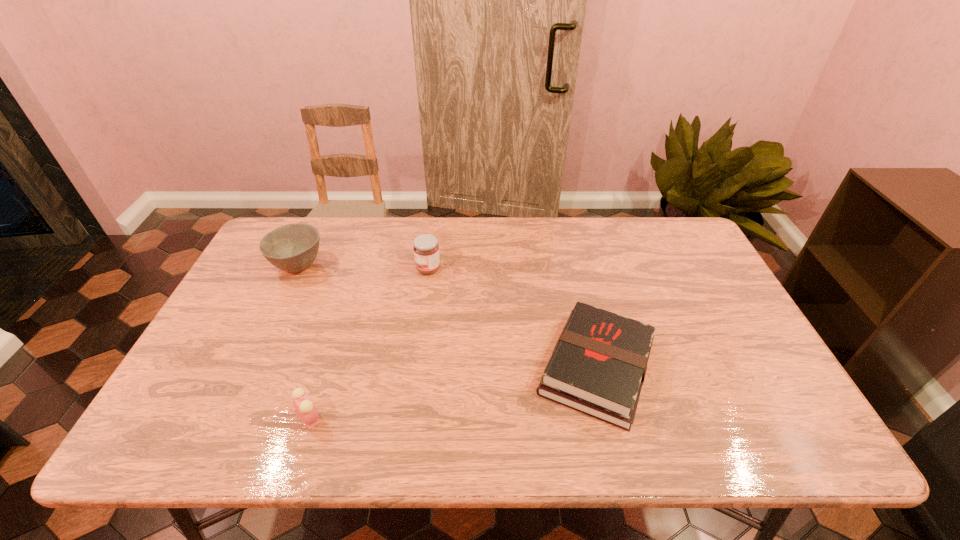
Where is `free space that satisfies the following two spatial constraints: 1. on the front side of the rightmost object; 2. on the left side of the leftmost object`? This screenshot has width=960, height=540. free space that satisfies the following two spatial constraints: 1. on the front side of the rightmost object; 2. on the left side of the leftmost object is located at coordinates (250, 368).

At what (x,y) coordinates should I click in order to perform the action: click on free spot that satisfies the following two spatial constraints: 1. on the front side of the rightmost object; 2. on the face of the alarm clock. Please return your answer as a coordinate pair (x, y). Looking at the image, I should click on (609, 418).